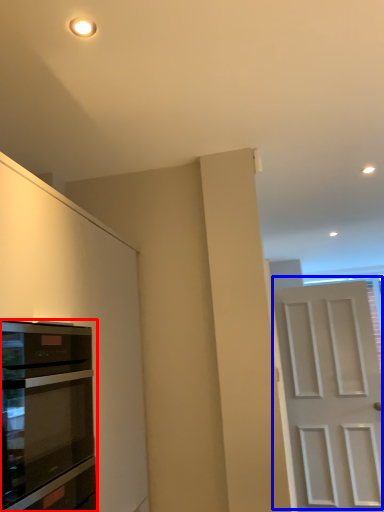
Question: Among these objects, which one is farthest to the camera, oven (highlighted by a red box) or door (highlighted by a blue box)?

Choices:
 (A) oven
 (B) door

Answer: (B)